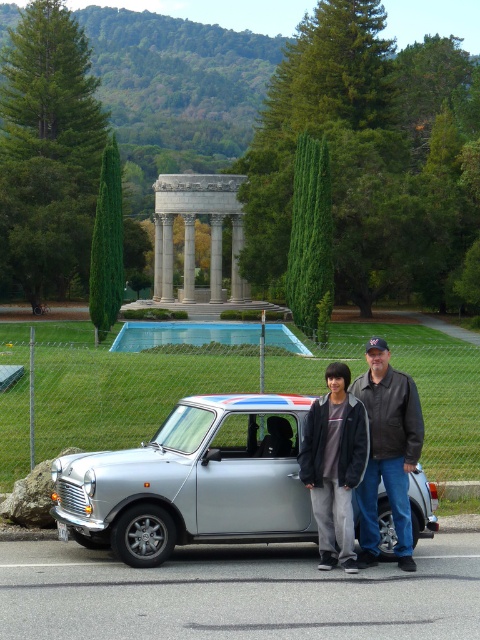
Question: Among these objects, which one is nearest to the camera?

Choices:
 (A) silver metallic car at center
 (B) dark gray jacket at center

Answer: (A)

Question: Does silver metallic car at center appear over dark gray jacket at center?

Choices:
 (A) yes
 (B) no

Answer: (A)

Question: Observing the image, what is the correct spatial positioning of silver metallic car at center in reference to dark gray jacket at center?

Choices:
 (A) below
 (B) above

Answer: (B)

Question: Which of the following is the farthest from the observer?

Choices:
 (A) silver metallic car at center
 (B) dark gray jacket at center

Answer: (B)

Question: Is silver metallic car at center behind dark gray jacket at center?

Choices:
 (A) yes
 (B) no

Answer: (B)

Question: Which point appears closest to the camera in this image?

Choices:
 (A) (283, 477)
 (B) (372, 339)

Answer: (A)